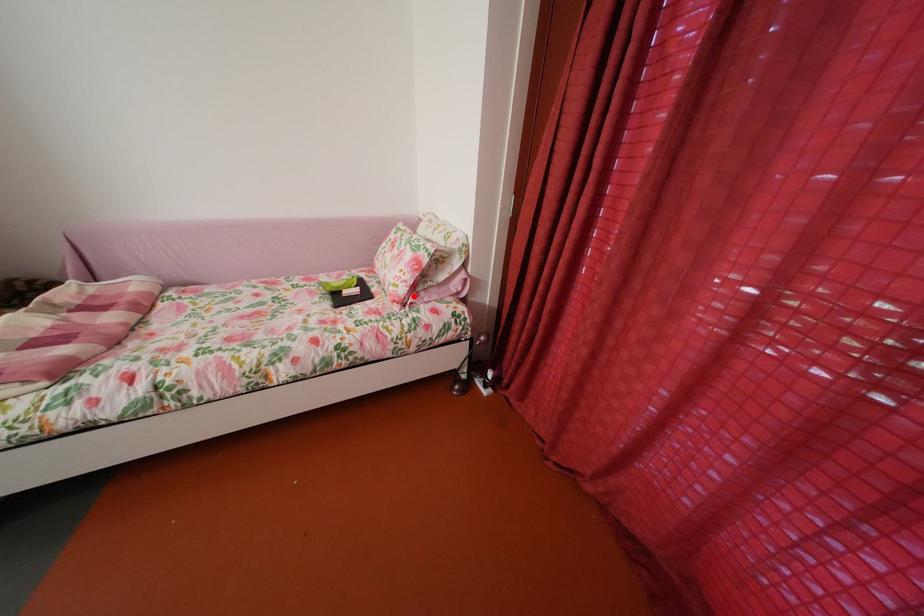
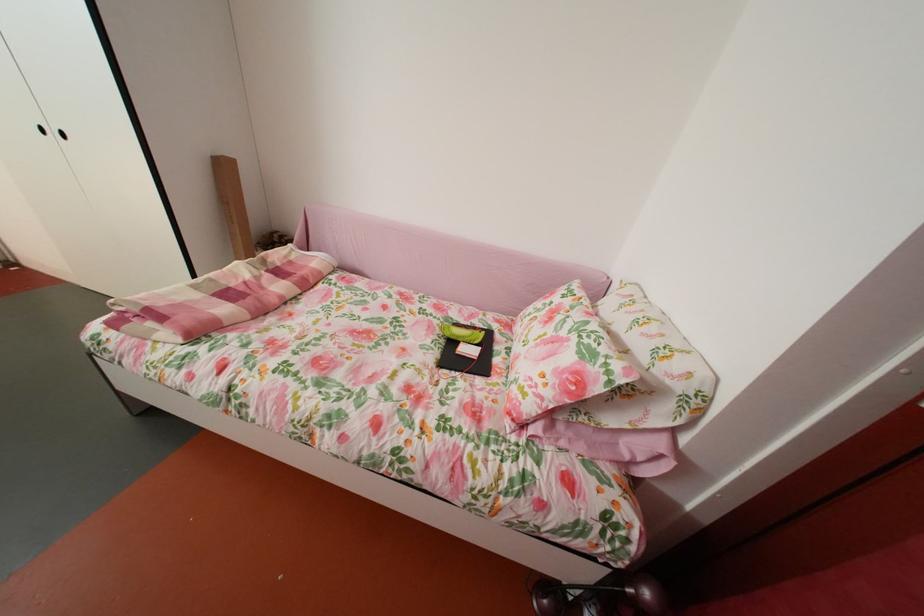
Locate, in the second image, the point that corresponds to the highlighted location in the first image.

(541, 413)